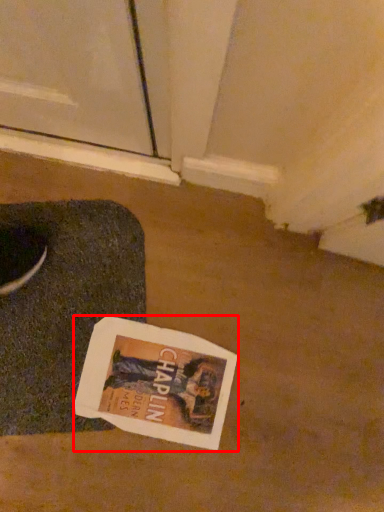
Question: From the image's perspective, where is magazine (annotated by the red box) located relative to yoga mat?

Choices:
 (A) above
 (B) below

Answer: (B)